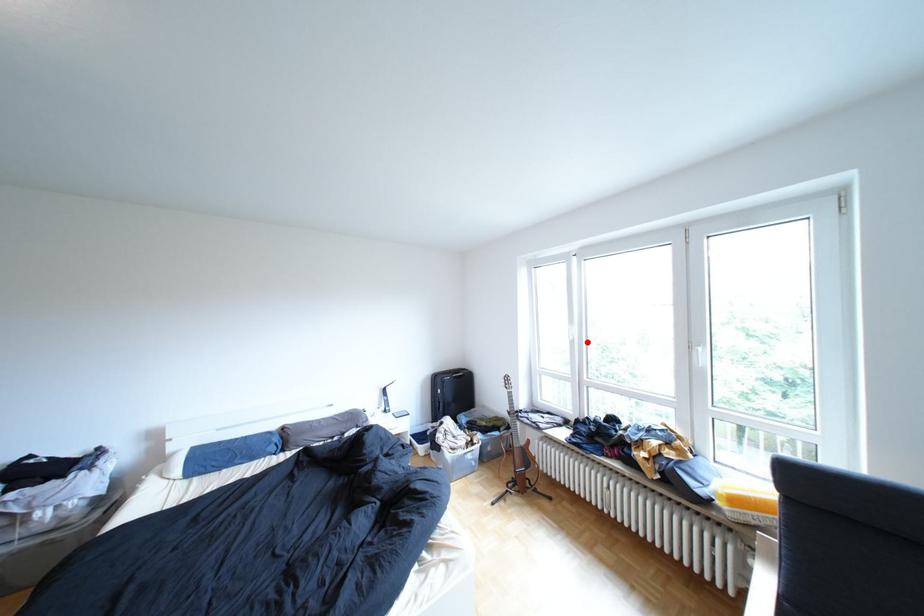
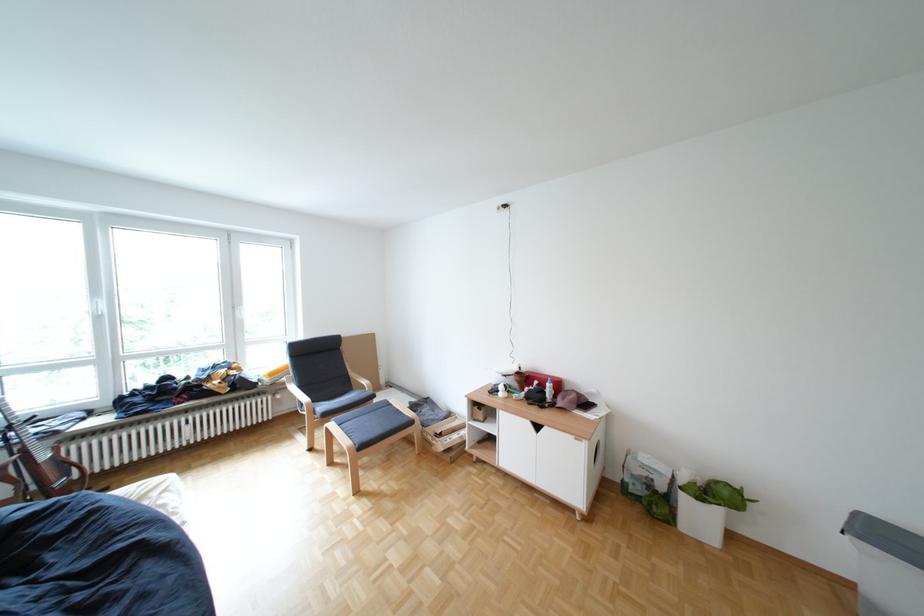
In the second image, find the point that corresponds to the highlighted location in the first image.

(114, 318)